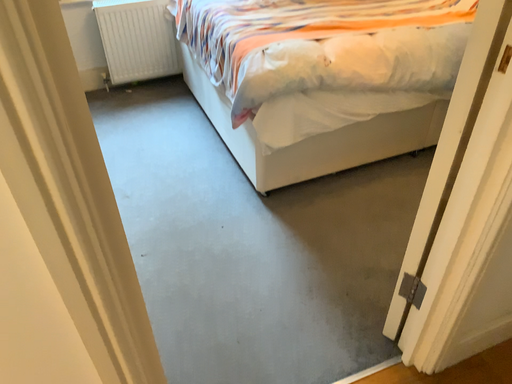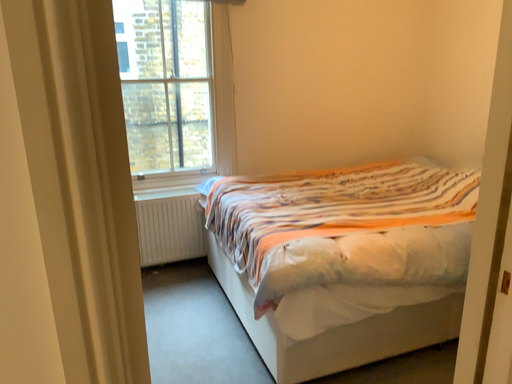
Question: How did the camera likely rotate when shooting the video?

Choices:
 (A) rotated downward
 (B) rotated upward

Answer: (B)